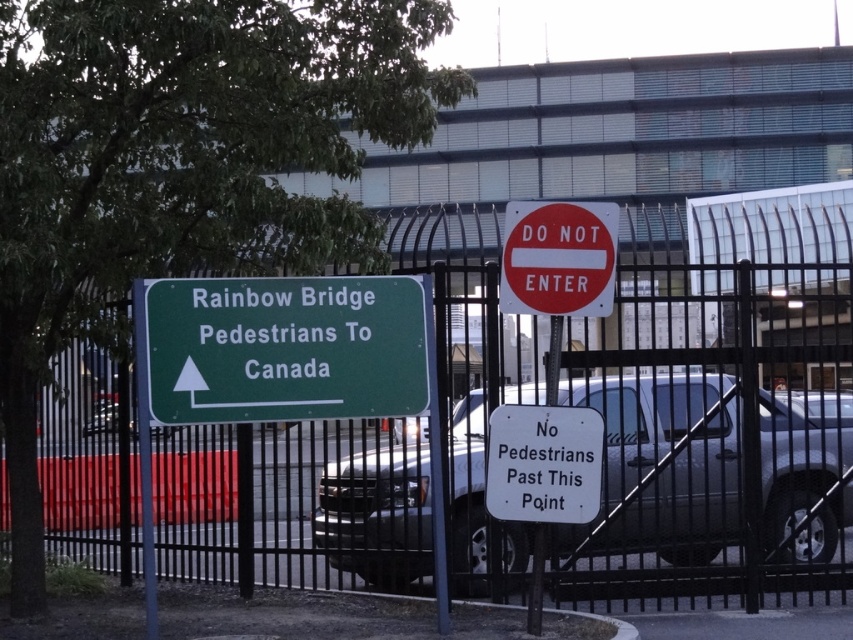
Which is more to the left, silver metallic truck at center or green metallic sign at upper left?

green metallic sign at upper left

Is silver metallic truck at center above green metallic sign at upper left?

Incorrect, silver metallic truck at center is not positioned above green metallic sign at upper left.

Describe the element at coordinates (662, 467) in the screenshot. The height and width of the screenshot is (640, 853). I see `silver metallic truck at center` at that location.

Locate an element on the screen. silver metallic truck at center is located at coordinates (662, 467).

Can you confirm if green metallic sign at upper left is smaller than white plastic sign at center?

No.

Is green metallic sign at upper left bigger than white plastic sign at center?

Yes.

Image resolution: width=853 pixels, height=640 pixels. Find the location of `green metallic sign at upper left`. green metallic sign at upper left is located at coordinates (283, 348).

Find the location of `white plastic sign at center`. white plastic sign at center is located at coordinates (543, 464).

From the picture: Does white plastic sign at center have a lesser height compared to red matte sign at center?

No.

Which is in front, point (492, 468) or point (524, 256)?

Point (524, 256) is in front.

Where is `white plastic sign at center`? This screenshot has height=640, width=853. white plastic sign at center is located at coordinates 543,464.